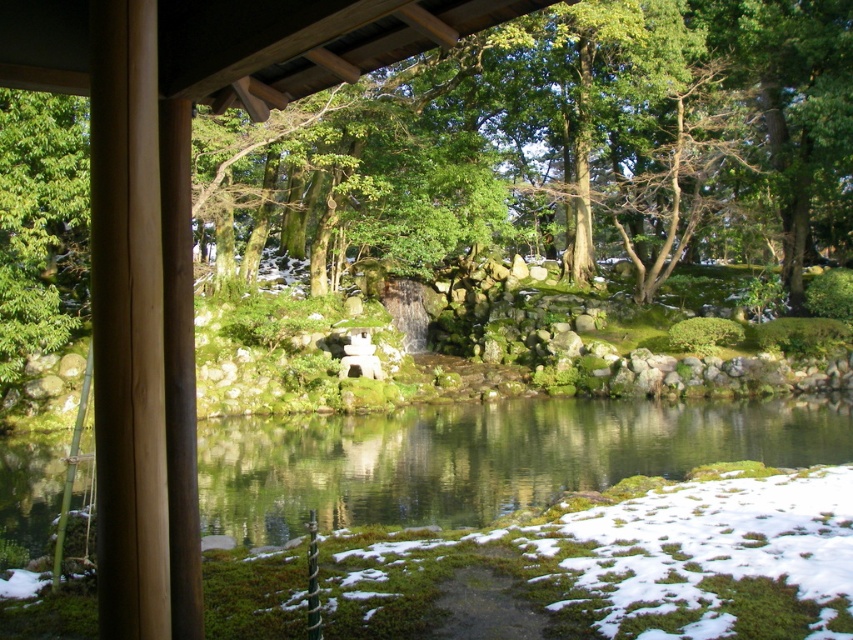
Question: Can you confirm if green mossy water at center is positioned to the right of green leafy tree at left?

Choices:
 (A) no
 (B) yes

Answer: (B)

Question: Is green mossy water at center to the left of green leafy tree at left from the viewer's perspective?

Choices:
 (A) no
 (B) yes

Answer: (A)

Question: Does green mossy water at center appear on the left side of green leafy tree at left?

Choices:
 (A) no
 (B) yes

Answer: (A)

Question: Which of the following is the farthest from the observer?

Choices:
 (A) (688, 408)
 (B) (28, 236)

Answer: (A)

Question: Which point is farther to the camera?

Choices:
 (A) (425, 406)
 (B) (27, 104)

Answer: (A)